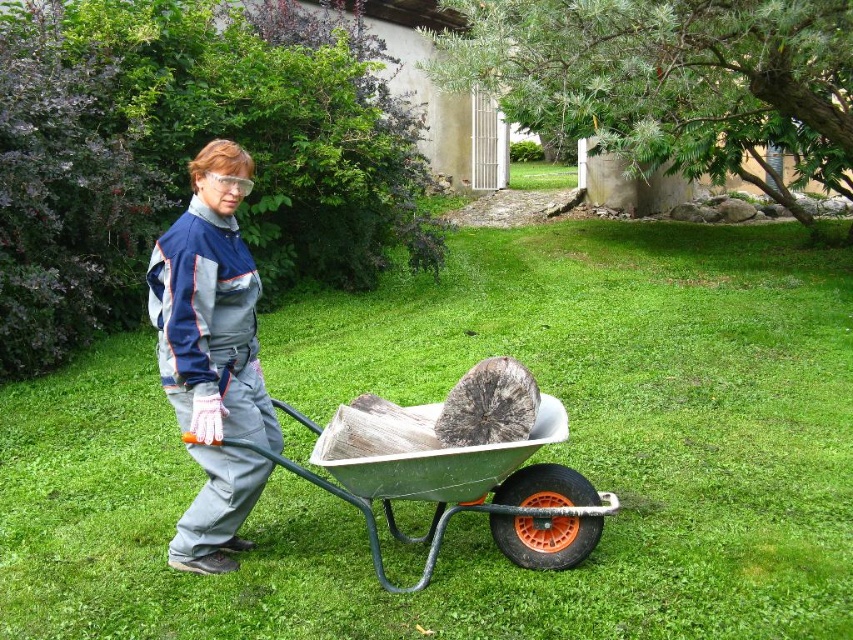
Question: Can you confirm if green grass at center is positioned above gray fabric jumpsuit at center?

Choices:
 (A) no
 (B) yes

Answer: (B)

Question: Which of the following is the closest to the observer?

Choices:
 (A) (230, 189)
 (B) (386, 529)

Answer: (A)

Question: Can you confirm if green grass at center is smaller than gray fabric jumpsuit at center?

Choices:
 (A) yes
 (B) no

Answer: (B)

Question: Which point is farther from the camera taking this photo?

Choices:
 (A) (755, 296)
 (B) (401, 481)
 (C) (192, 417)

Answer: (A)

Question: Does green grass at center appear over gray fabric jumpsuit at center?

Choices:
 (A) no
 (B) yes

Answer: (B)

Question: Which of the following is the farthest from the observer?

Choices:
 (A) gray fabric jumpsuit at center
 (B) green metallic wheelbarrow at center
 (C) green grass at center

Answer: (B)